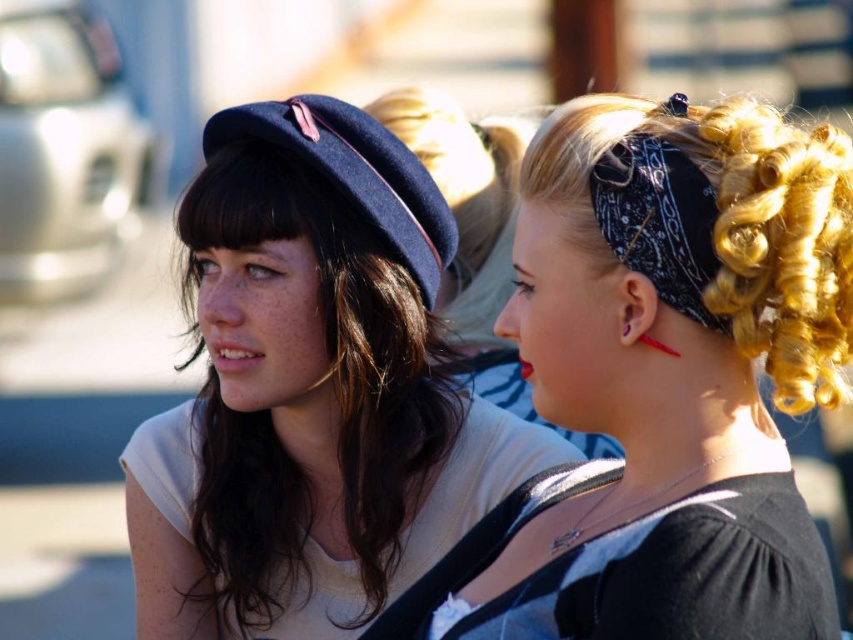
Question: Is black bandana at right to the left of dark brown silky hair at center from the viewer's perspective?

Choices:
 (A) no
 (B) yes

Answer: (A)

Question: Which point is farther to the camera?

Choices:
 (A) (440, 458)
 (B) (779, 157)

Answer: (A)

Question: Is black bandana at right below dark brown silky hair at center?

Choices:
 (A) no
 (B) yes

Answer: (B)

Question: Which object appears closest to the camera in this image?

Choices:
 (A) black bandana at right
 (B) dark brown silky hair at center

Answer: (A)

Question: In this image, where is black bandana at right located relative to dark brown silky hair at center?

Choices:
 (A) above
 (B) below

Answer: (B)

Question: Which point is farther from the camera taking this photo?

Choices:
 (A) (749, 573)
 (B) (254, 564)

Answer: (B)